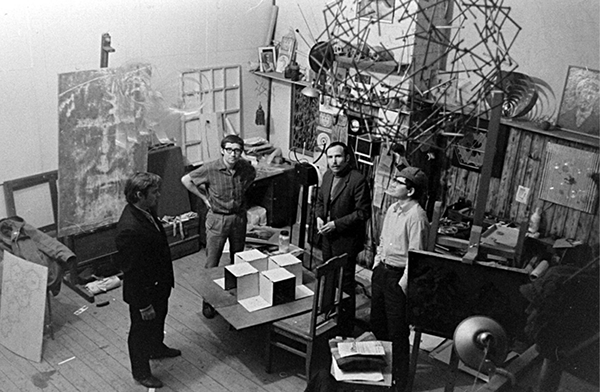
Where is `lamp`? This screenshot has width=600, height=392. lamp is located at coordinates (497, 345).